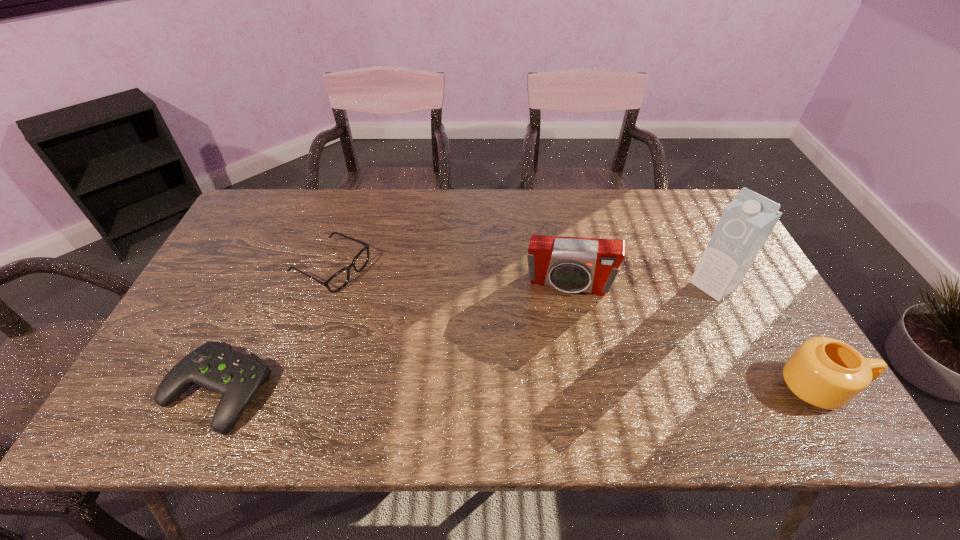
In order to click on free space between the third object from right to left and the spectacles in this screenshot , I will do `click(449, 276)`.

The width and height of the screenshot is (960, 540). Identify the location of free space between the tallest object and the camera. pyautogui.click(x=641, y=284).

This screenshot has height=540, width=960. I want to click on vacant point located between the mug and the control, so click(518, 389).

Find the location of a particular element. The width and height of the screenshot is (960, 540). unoccupied area between the fourth shortest object and the control is located at coordinates (393, 337).

At what (x,y) coordinates should I click in order to perform the action: click on free area in between the camera and the carton. Please return your answer as a coordinate pair (x, y). This screenshot has height=540, width=960. Looking at the image, I should click on (641, 284).

You are a GUI agent. You are given a task and a screenshot of the screen. Output one action in this format:
    pyautogui.click(x=<x>, y=<y>)
    Task: Click on the free point between the spectacles and the control
    
    Given the screenshot: What is the action you would take?
    pyautogui.click(x=274, y=329)

Locate an element on the screen. The image size is (960, 540). vacant point located between the spectacles and the carton is located at coordinates (522, 276).

You are a GUI agent. You are given a task and a screenshot of the screen. Output one action in this format:
    pyautogui.click(x=<x>, y=<y>)
    Task: Click on the object identified as the third closest to the spectacles
    This screenshot has height=540, width=960.
    Given the screenshot: What is the action you would take?
    pyautogui.click(x=746, y=223)

Image resolution: width=960 pixels, height=540 pixels. I want to click on the fourth closest object relative to the mug, so click(215, 366).

Find the location of a particular element. This screenshot has width=960, height=540. free location that satisfies the following two spatial constraints: 1. on the front side of the spectacles; 2. on the handle side of the mug is located at coordinates (292, 388).